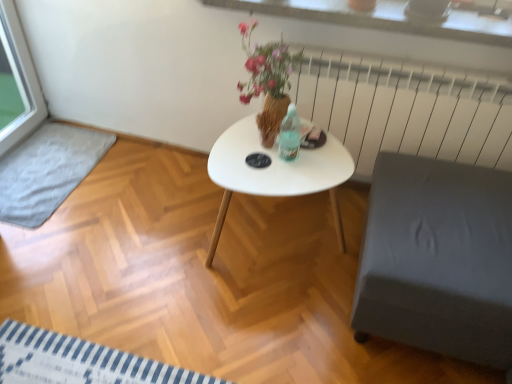
Question: Is white matte coffee table at center closer to the viewer compared to white metal radiator at upper right?

Choices:
 (A) no
 (B) yes

Answer: (B)

Question: Would you say white matte coffee table at center is a long distance from white metal radiator at upper right?

Choices:
 (A) no
 (B) yes

Answer: (A)

Question: Is the position of white matte coffee table at center more distant than that of white metal radiator at upper right?

Choices:
 (A) no
 (B) yes

Answer: (A)

Question: Considering the relative sizes of white matte coffee table at center and white metal radiator at upper right in the image provided, is white matte coffee table at center wider than white metal radiator at upper right?

Choices:
 (A) yes
 (B) no

Answer: (A)

Question: Can you confirm if white matte coffee table at center is bigger than white metal radiator at upper right?

Choices:
 (A) no
 (B) yes

Answer: (B)

Question: Is white metal radiator at upper right located within white matte coffee table at center?

Choices:
 (A) yes
 (B) no

Answer: (B)

Question: From the image's perspective, is gray fabric ottoman at lower right above white metal radiator at upper right?

Choices:
 (A) yes
 (B) no

Answer: (B)

Question: Considering the relative sizes of gray fabric ottoman at lower right and white metal radiator at upper right in the image provided, is gray fabric ottoman at lower right taller than white metal radiator at upper right?

Choices:
 (A) no
 (B) yes

Answer: (B)

Question: Is gray fabric ottoman at lower right thinner than white metal radiator at upper right?

Choices:
 (A) yes
 (B) no

Answer: (B)

Question: Does gray fabric ottoman at lower right have a smaller size compared to white metal radiator at upper right?

Choices:
 (A) yes
 (B) no

Answer: (B)

Question: Considering the relative sizes of gray fabric ottoman at lower right and white metal radiator at upper right in the image provided, is gray fabric ottoman at lower right shorter than white metal radiator at upper right?

Choices:
 (A) no
 (B) yes

Answer: (A)

Question: From a real-world perspective, does gray fabric ottoman at lower right sit lower than white metal radiator at upper right?

Choices:
 (A) yes
 (B) no

Answer: (A)

Question: Is white metal radiator at upper right surrounding white glossy table at center?

Choices:
 (A) yes
 (B) no

Answer: (B)